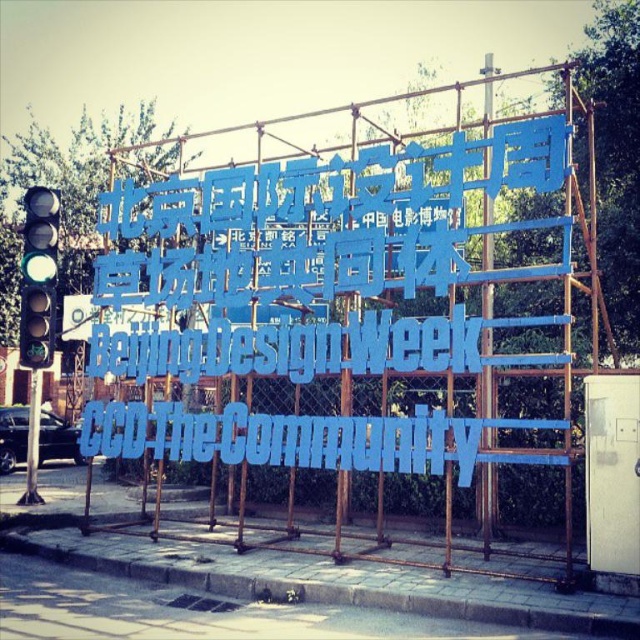
Question: Which point is closer to the camera?

Choices:
 (A) (28, 227)
 (B) (332, 451)

Answer: (B)

Question: Does blue plastic text at center lie behind green matte traffic light at left?

Choices:
 (A) no
 (B) yes

Answer: (A)

Question: Which of the following is the farthest from the observer?

Choices:
 (A) [40, 262]
 (B) [221, 445]

Answer: (A)

Question: Among these points, which one is nearest to the camera?

Choices:
 (A) (144, 413)
 (B) (264, 349)
 (C) (35, 204)

Answer: (B)

Question: Is blue plastic letters at center positioned in front of blue plastic text at center?

Choices:
 (A) yes
 (B) no

Answer: (A)

Question: Observing the image, what is the correct spatial positioning of blue plastic text at center in reference to green matte traffic light at left?

Choices:
 (A) left
 (B) right

Answer: (B)